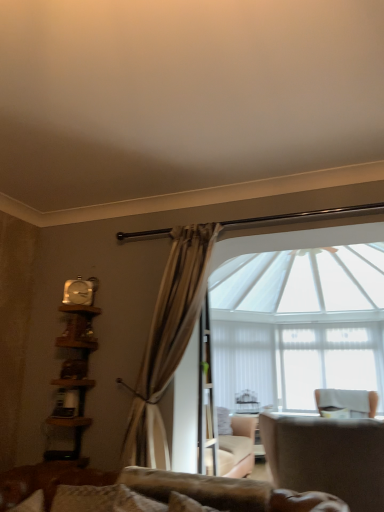
What do you see at coordinates (348, 401) in the screenshot? I see `white fabric chair at right, which appears as the 2th chair when viewed from the top` at bounding box center [348, 401].

Describe the element at coordinates (327, 362) in the screenshot. I see `white sheer fabric at center` at that location.

This screenshot has height=512, width=384. Find the location of `leather-like beige armchair at lower right, marked as the 2th chair in a right-to-left arrangement`. leather-like beige armchair at lower right, marked as the 2th chair in a right-to-left arrangement is located at coordinates (327, 457).

The image size is (384, 512). Describe the element at coordinates (327, 457) in the screenshot. I see `leather-like beige armchair at lower right, which is the first chair from front to back` at that location.

This screenshot has width=384, height=512. I want to click on white fabric chair at right, positioned as the first chair in back-to-front order, so click(348, 401).

Considering the relative positions of leather-like beige armchair at lower right, which ranks as the 2th chair in back-to-front order, and white sheer fabric at center in the image provided, is leather-like beige armchair at lower right, which ranks as the 2th chair in back-to-front order, to the right of white sheer fabric at center from the viewer's perspective?

In fact, leather-like beige armchair at lower right, which ranks as the 2th chair in back-to-front order, is to the left of white sheer fabric at center.

What's the angular difference between leather-like beige armchair at lower right, marked as the 2th chair in a right-to-left arrangement, and white sheer fabric at center's facing directions?

The angular difference between leather-like beige armchair at lower right, marked as the 2th chair in a right-to-left arrangement, and white sheer fabric at center is 179 degrees.

Is leather-like beige armchair at lower right, which is the first chair from front to back, situated inside white sheer fabric at center or outside?

leather-like beige armchair at lower right, which is the first chair from front to back, is not enclosed by white sheer fabric at center.

Is leather-like beige armchair at lower right, which is the first chair from front to back, smaller than white sheer fabric at center?

Incorrect, leather-like beige armchair at lower right, which is the first chair from front to back, is not smaller in size than white sheer fabric at center.

From a real-world perspective, which object stands above the other?

In real-world perspective, white sheer fabric at center is above.

Where is `chair that is below the white sheer fabric at center (from the image's perspective)`? The image size is (384, 512). chair that is below the white sheer fabric at center (from the image's perspective) is located at coordinates (348, 401).

Considering the positions of objects white sheer fabric at center and white fabric chair at right, which appears as the first chair when ordered from the bottom, in the image provided, who is more to the right, white sheer fabric at center or white fabric chair at right, which appears as the first chair when ordered from the bottom,?

white sheer fabric at center.

Is there a large distance between white sheer fabric at center and white fabric chair at right, which is counted as the second chair, starting from the front?

They are positioned close to each other.

In terms of size, does white fabric chair at right, the 1th chair in the right-to-left sequence, appear bigger or smaller than metallic silver clock at upper left?

Considering their sizes, white fabric chair at right, the 1th chair in the right-to-left sequence, takes up more space than metallic silver clock at upper left.

Is there a large distance between white fabric chair at right, which is counted as the second chair, starting from the front, and metallic silver clock at upper left?

Indeed, white fabric chair at right, which is counted as the second chair, starting from the front, is not near metallic silver clock at upper left.

From the image's perspective, which one is positioned higher, white fabric chair at right, which appears as the first chair when ordered from the bottom, or metallic silver clock at upper left?

metallic silver clock at upper left appears higher in the image.

Could you tell me if white fabric chair at right, which appears as the first chair when ordered from the bottom, is facing metallic silver clock at upper left?

Yes.

Is wooden bookshelf at left not inside white sheer fabric at center?

Indeed, wooden bookshelf at left is completely outside white sheer fabric at center.

From a real-world perspective, is wooden bookshelf at left above or below white sheer fabric at center?

Clearly, from a real-world perspective, wooden bookshelf at left is below white sheer fabric at center.

Is wooden bookshelf at left touching white sheer fabric at center?

No, wooden bookshelf at left is not making contact with white sheer fabric at center.

Between wooden bookshelf at left and white sheer fabric at center, which one has smaller size?

wooden bookshelf at left.

Is white fabric chair at right, positioned as the first chair in back-to-front order, facing away from wooden bookshelf at left?

No, white fabric chair at right, positioned as the first chair in back-to-front order, is not facing the opposite direction of wooden bookshelf at left.

Is white fabric chair at right, which appears as the 2th chair when viewed from the top, located outside wooden bookshelf at left?

That's correct, white fabric chair at right, which appears as the 2th chair when viewed from the top, is outside of wooden bookshelf at left.

Is point (347, 402) closer or farther from the camera than point (85, 378)?

Point (347, 402) is positioned farther from the camera compared to point (85, 378).

Considering the relative sizes of white fabric chair at right, positioned as the first chair in back-to-front order, and wooden bookshelf at left in the image provided, is white fabric chair at right, positioned as the first chair in back-to-front order, bigger than wooden bookshelf at left?

Correct, white fabric chair at right, positioned as the first chair in back-to-front order, is larger in size than wooden bookshelf at left.

Are metallic silver clock at upper left and leather-like beige armchair at lower right, arranged as the first chair when viewed from the left, located far from each other?

metallic silver clock at upper left is positioned a significant distance from leather-like beige armchair at lower right, arranged as the first chair when viewed from the left.

Is metallic silver clock at upper left oriented towards leather-like beige armchair at lower right, which appears as the first chair when viewed from the top?

No, metallic silver clock at upper left is not aimed at leather-like beige armchair at lower right, which appears as the first chair when viewed from the top.

From the image's perspective, which one is positioned lower, metallic silver clock at upper left or leather-like beige armchair at lower right, marked as the 2th chair in a right-to-left arrangement?

leather-like beige armchair at lower right, marked as the 2th chair in a right-to-left arrangement.

Considering the sizes of objects metallic silver clock at upper left and leather-like beige armchair at lower right, which appears as the first chair when viewed from the top, in the image provided, who is taller, metallic silver clock at upper left or leather-like beige armchair at lower right, which appears as the first chair when viewed from the top,?

leather-like beige armchair at lower right, which appears as the first chair when viewed from the top.

Is white sheer fabric at center turned away from leather-like beige armchair at lower right, which appears as the first chair when viewed from the top?

No, white sheer fabric at center's orientation is not away from leather-like beige armchair at lower right, which appears as the first chair when viewed from the top.

From the image's perspective, which one is positioned lower, white sheer fabric at center or leather-like beige armchair at lower right, arranged as the first chair when viewed from the left?

white sheer fabric at center appears lower in the image.

Is white sheer fabric at center surrounding leather-like beige armchair at lower right, placed as the second chair when sorted from bottom to top?

No.

From the picture: Looking at the image, does white sheer fabric at center seem bigger or smaller compared to leather-like beige armchair at lower right, which appears as the first chair when viewed from the top?

white sheer fabric at center is smaller than leather-like beige armchair at lower right, which appears as the first chair when viewed from the top.

At what (x,y) coordinates should I click in order to perform the action: click on chair that is the 2nd one when counting forward from the white sheer fabric at center. Please return your answer as a coordinate pair (x, y). Looking at the image, I should click on (327, 457).

Locate an element on the screen. The width and height of the screenshot is (384, 512). the 1st chair positioned below the white sheer fabric at center (from a real-world perspective) is located at coordinates (348, 401).

Based on their spatial positions, is white sheer fabric at center or leather-like beige armchair at lower right, which appears as the first chair when viewed from the top, further from white fabric chair at right, which is counted as the second chair, starting from the front?

Among the two, leather-like beige armchair at lower right, which appears as the first chair when viewed from the top, is located further to white fabric chair at right, which is counted as the second chair, starting from the front.

Which object lies further to the anchor point white fabric chair at right, acting as the 2th chair starting from the left, white sheer fabric at center or metallic silver clock at upper left?

The object further to white fabric chair at right, acting as the 2th chair starting from the left, is metallic silver clock at upper left.

Based on their spatial positions, is white sheer fabric at center or wooden bookshelf at left further from white fabric chair at right, which is counted as the second chair, starting from the front?

Among the two, wooden bookshelf at left is located further to white fabric chair at right, which is counted as the second chair, starting from the front.

Which object lies nearer to the anchor point wooden bookshelf at left, white sheer fabric at center or white fabric chair at right, which appears as the 2th chair when viewed from the top?

white fabric chair at right, which appears as the 2th chair when viewed from the top, lies closer to wooden bookshelf at left than the other object.

Which object lies nearer to the anchor point metallic silver clock at upper left, leather-like beige armchair at lower right, which ranks as the 2th chair in back-to-front order, or white fabric chair at right, which appears as the 2th chair when viewed from the top?

leather-like beige armchair at lower right, which ranks as the 2th chair in back-to-front order, lies closer to metallic silver clock at upper left than the other object.

Based on their spatial positions, is wooden bookshelf at left or white fabric chair at right, acting as the 2th chair starting from the left, closer to leather-like beige armchair at lower right, marked as the 2th chair in a right-to-left arrangement?

white fabric chair at right, acting as the 2th chair starting from the left, is closer to leather-like beige armchair at lower right, marked as the 2th chair in a right-to-left arrangement.

From the image, which object appears to be nearer to white fabric chair at right, the 1th chair in the right-to-left sequence, metallic silver clock at upper left or leather-like beige armchair at lower right, which is the first chair from front to back?

leather-like beige armchair at lower right, which is the first chair from front to back, is closer to white fabric chair at right, the 1th chair in the right-to-left sequence.

From the image, which object appears to be farther from leather-like beige armchair at lower right, arranged as the first chair when viewed from the left, white fabric chair at right, which appears as the first chair when ordered from the bottom, or wooden bookshelf at left?

wooden bookshelf at left is positioned further to the anchor leather-like beige armchair at lower right, arranged as the first chair when viewed from the left.

This screenshot has width=384, height=512. In order to click on bookshelf between leather-like beige armchair at lower right, which is the first chair from front to back, and white fabric chair at right, which appears as the first chair when ordered from the bottom, in the front-back direction in this screenshot , I will do `click(74, 375)`.

The height and width of the screenshot is (512, 384). Identify the location of clock between leather-like beige armchair at lower right, which appears as the first chair when viewed from the top, and white sheer fabric at center, along the z-axis. pyautogui.click(x=80, y=291).

Where is `bookshelf situated between metallic silver clock at upper left and leather-like beige armchair at lower right, which is the first chair from front to back, from left to right`? bookshelf situated between metallic silver clock at upper left and leather-like beige armchair at lower right, which is the first chair from front to back, from left to right is located at coordinates (74, 375).

At what (x,y) coordinates should I click in order to perform the action: click on chair positioned between leather-like beige armchair at lower right, placed as the second chair when sorted from bottom to top, and white sheer fabric at center from near to far. Please return your answer as a coordinate pair (x, y). Looking at the image, I should click on (348, 401).